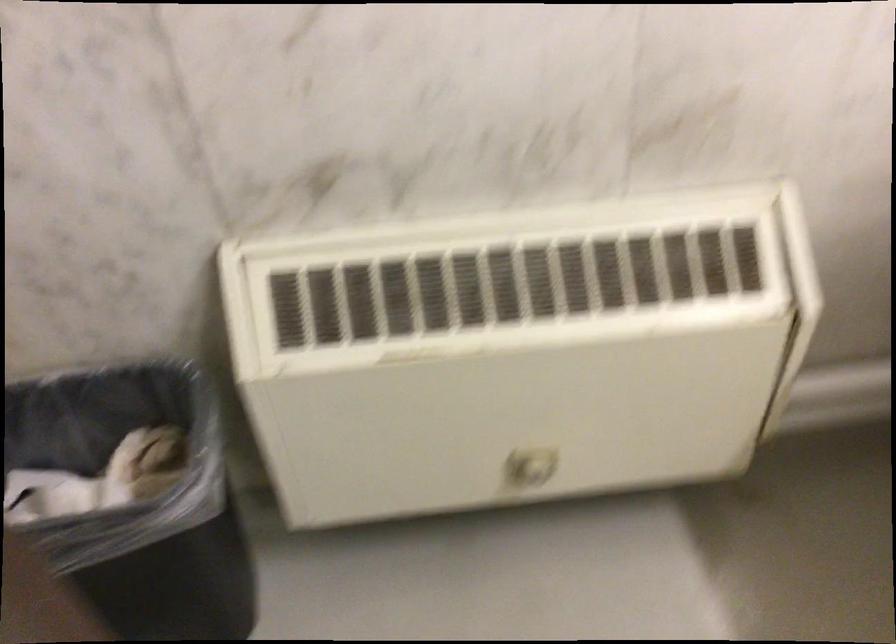
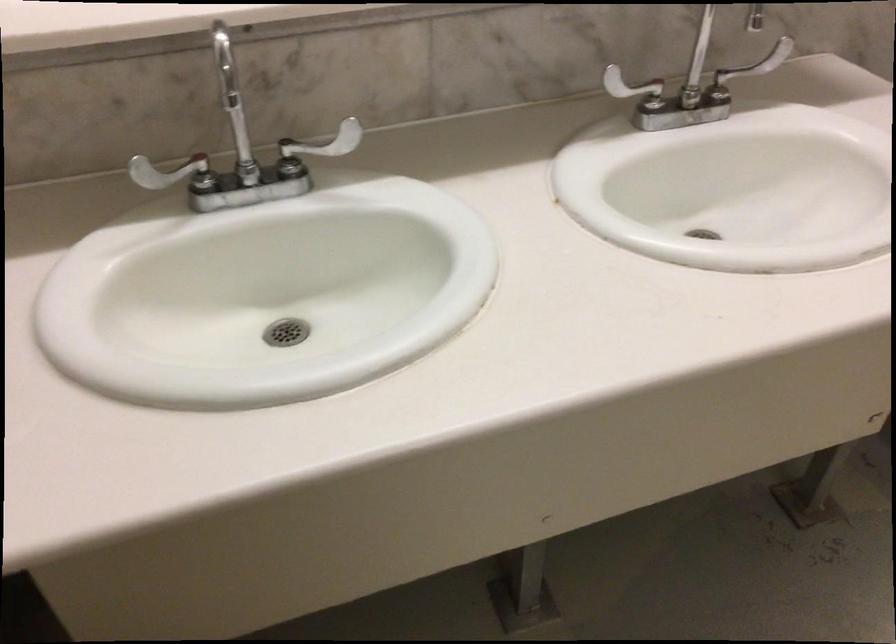
The first image is from the beginning of the video and the second image is from the end. How did the camera likely rotate when shooting the video?

The camera rotated toward right-down.